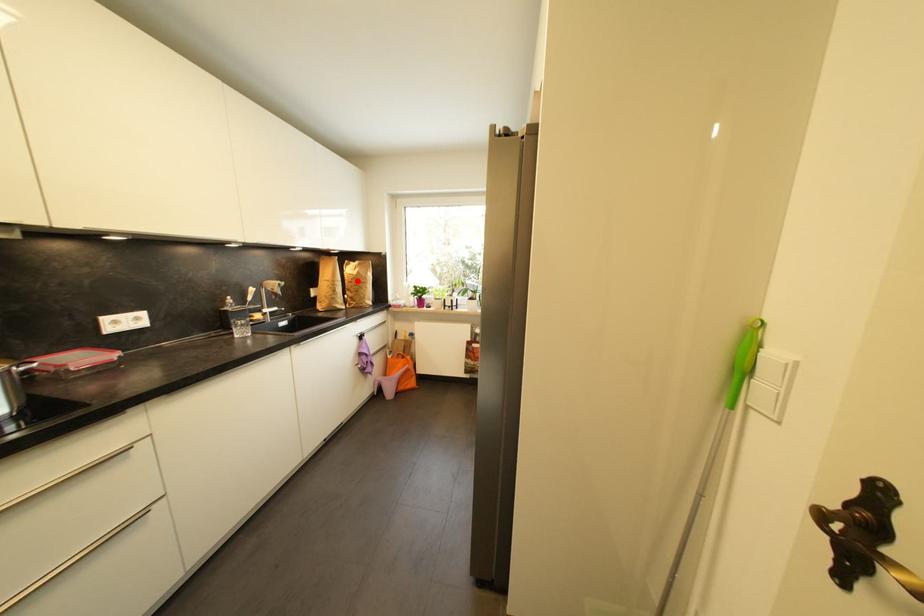
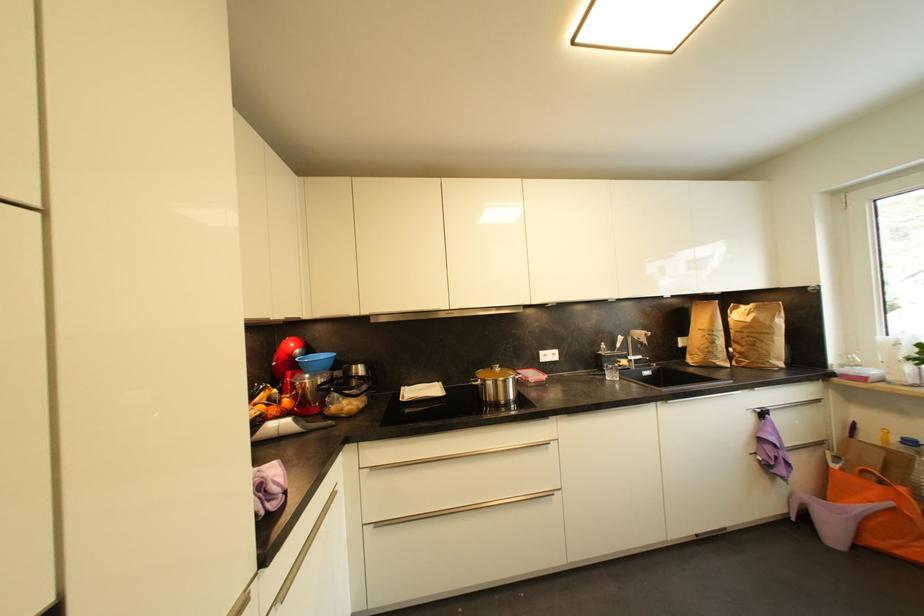
Question: I am providing you with two images of the same scene from different viewpoints. Given a red point in image1, look at the same physical point in image2. Is it:

Choices:
 (A) Closer to the viewpoint
 (B) Farther from the viewpoint

Answer: (B)